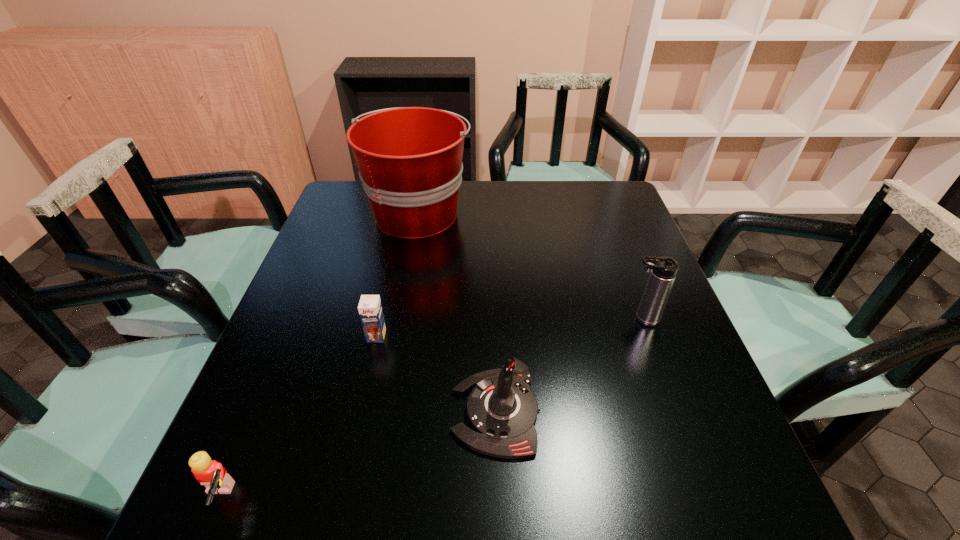
You are a GUI agent. You are given a task and a screenshot of the screen. Output one action in this format:
    pyautogui.click(x=<x>, y=<y>)
    Task: Click on the bucket
    
    Given the screenshot: What is the action you would take?
    pyautogui.click(x=410, y=163)

I want to click on the tallest object, so click(x=410, y=163).

The image size is (960, 540). What are the coordinates of `thermos bottle` in the screenshot? It's located at (663, 269).

This screenshot has height=540, width=960. I want to click on the second farthest object, so click(x=663, y=269).

Locate an element on the screen. This screenshot has width=960, height=540. the third tallest object is located at coordinates (502, 410).

You are a GUI agent. You are given a task and a screenshot of the screen. Output one action in this format:
    pyautogui.click(x=<x>, y=<y>)
    Task: Click on the joystick
    The image size is (960, 540).
    Given the screenshot: What is the action you would take?
    pyautogui.click(x=502, y=410)

The image size is (960, 540). I want to click on chocolate milk, so click(370, 310).

In order to click on Lego in this screenshot , I will do `click(210, 473)`.

At what (x,y) coordinates should I click in order to perform the action: click on the nearest object. Please return your answer as a coordinate pair (x, y). Looking at the image, I should click on (210, 473).

Find the location of a particular element. This screenshot has width=960, height=540. vacant region located on the front of the bucket is located at coordinates (405, 286).